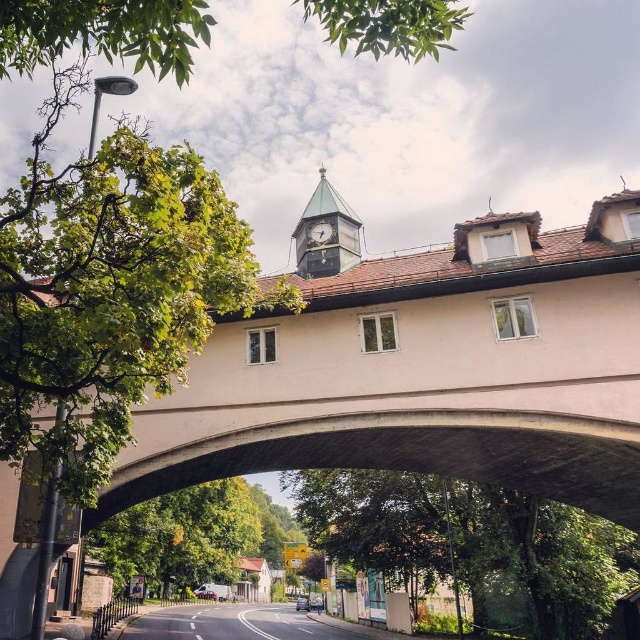
You are standing on the historic bridge and want to determine which of the two points, point (548, 369) or point (314, 198), is closer to you. Based on the scene description, which point is nearer?

Point (548, 369) is closer to the viewer than point (314, 198).

Based on the photo, you are standing in the middle of a road that curves under the smooth concrete bridge at center. You want to cross the road to reach a park on the other side. The road is 12 meters wide. Can you safely cross the road without needing to walk too far from the bridge?

The distance between you and the smooth concrete bridge at center is 14.62 meters. Since the road is 12 meters wide, you can safely cross the road by staying close to the bridge, as the required distance to cross is less than the available space between you and the bridge.

You are a pedestrian standing on the sidewalk. You see the smooth concrete bridge at center and the green glass clock tower at upper center. Which object is higher from the ground?

The green glass clock tower at upper center is higher from the ground than the smooth concrete bridge at center because it is located above it.